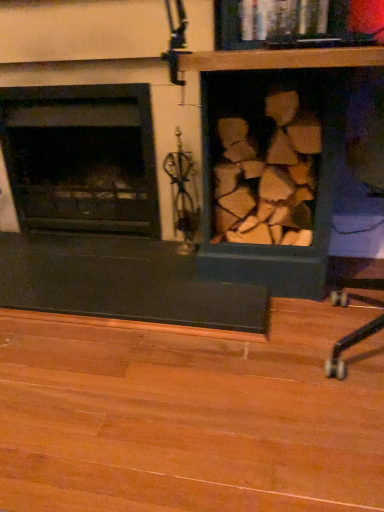
Identify the location of black glass wood burning stove at left. (81, 158).

What do you see at coordinates (81, 158) in the screenshot?
I see `black glass wood burning stove at left` at bounding box center [81, 158].

In the scene shown: Measure the distance between black glass wood burning stove at left and camera.

black glass wood burning stove at left and camera are 5.33 feet apart from each other.

At what (x,y) coordinates should I click in order to perform the action: click on black glass wood burning stove at left. Please return your answer as a coordinate pair (x, y). Looking at the image, I should click on tap(81, 158).